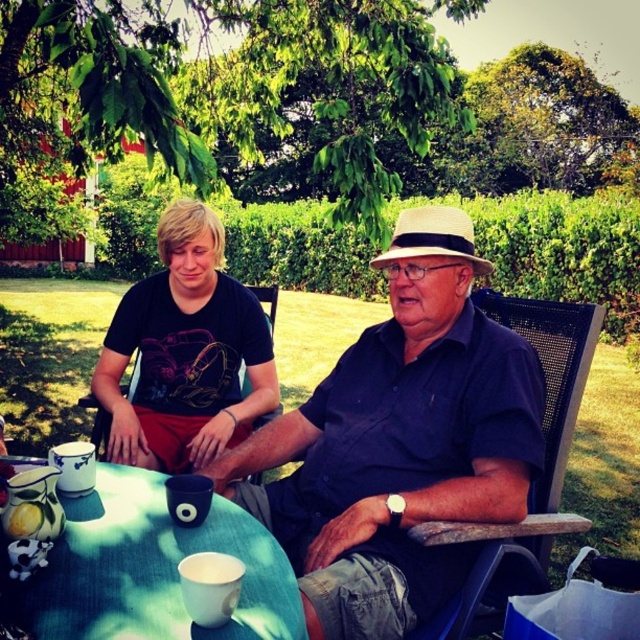
Is green fabric table at center to the left of black plastic chair at left from the viewer's perspective?

No, green fabric table at center is not to the left of black plastic chair at left.

In the scene shown: Does green fabric table at center have a lesser width compared to black plastic chair at left?

Incorrect, green fabric table at center's width is not less than black plastic chair at left's.

Between point (52, 572) and point (83, 396), which one is positioned behind?

The point (83, 396) is behind.

In order to click on green fabric table at center in this screenshot , I will do `click(148, 570)`.

Which of these two, matte blue shirt at center or green fabric table at center, stands taller?

matte blue shirt at center is taller.

In the scene shown: Is matte blue shirt at center thinner than green fabric table at center?

No.

In order to click on matte blue shirt at center in this screenshot , I will do pyautogui.click(x=400, y=442).

Between matte blue shirt at center and black plastic chair at left, which one appears on the right side from the viewer's perspective?

matte blue shirt at center

Who is more forward, (420, 586) or (138, 378)?

Positioned in front is point (420, 586).

Which is behind, point (326, 493) or point (246, 380)?

Positioned behind is point (246, 380).

At what (x,y) coordinates should I click in order to perform the action: click on matte blue shirt at center. Please return your answer as a coordinate pair (x, y). Image resolution: width=640 pixels, height=640 pixels. Looking at the image, I should click on (400, 442).